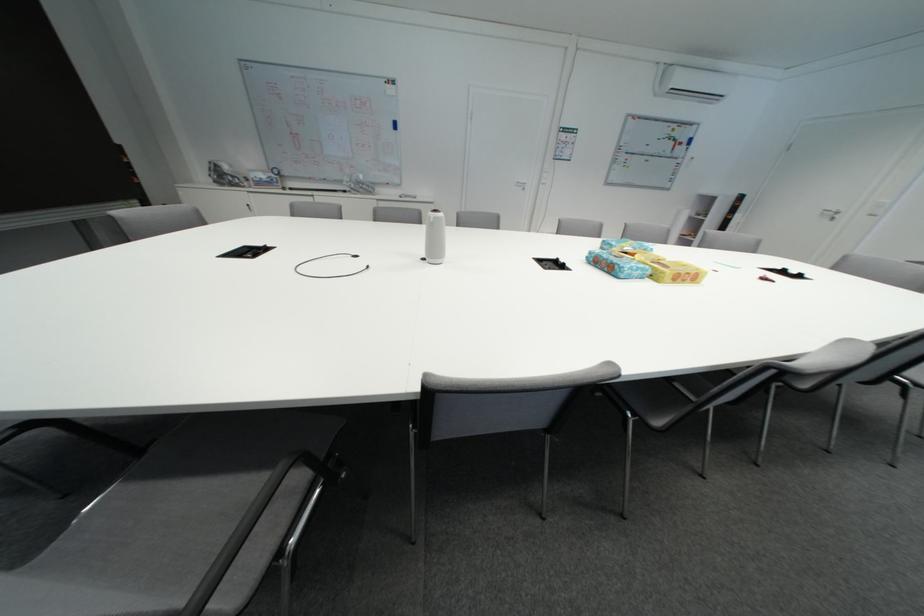
Locate an element on the screen. The image size is (924, 616). black cable loop is located at coordinates (329, 265).